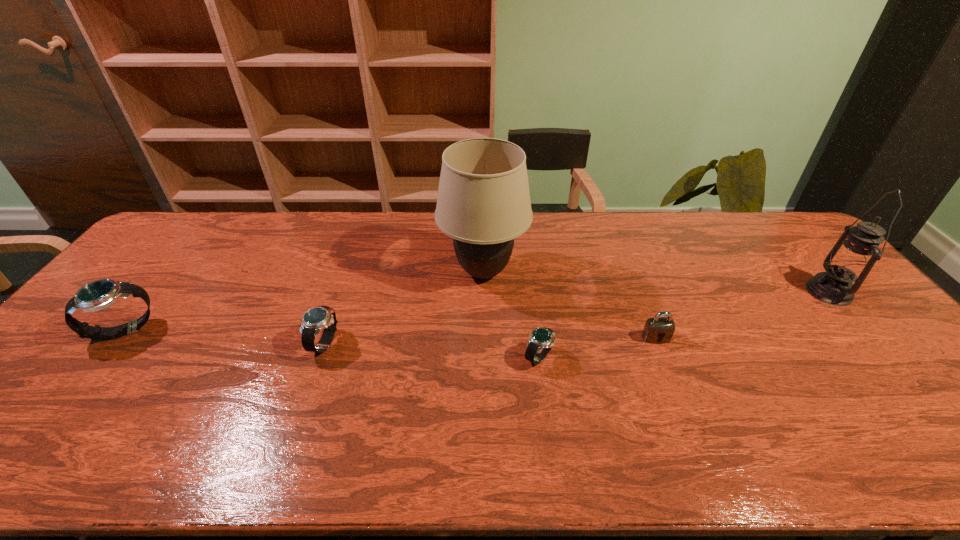
Find the location of a particular element. Image resolution: width=960 pixels, height=540 pixels. vacant space that is in between the shortest object and the lampshade is located at coordinates tap(511, 315).

Find the location of a particular element. vacant area that lies between the rightmost object and the lampshade is located at coordinates (656, 282).

Find the location of a particular element. The height and width of the screenshot is (540, 960). vacant point located between the oil lamp and the tallest watch is located at coordinates (477, 311).

Select which object appears as the closest to the leftmost object. Please provide its 2D coordinates. Your answer should be formatted as a tuple, i.e. [(x, y)], where the tuple contains the x and y coordinates of a point satisfying the conditions above.

[(315, 319)]

Find the location of a particular element. This screenshot has height=540, width=960. object that is the closest to the third tallest object is located at coordinates (315, 319).

Select which watch appears as the second closest to the rightmost watch. Please provide its 2D coordinates. Your answer should be formatted as a tuple, i.e. [(x, y)], where the tuple contains the x and y coordinates of a point satisfying the conditions above.

[(100, 294)]

Locate which watch is the closest to the rightmost object. Please provide its 2D coordinates. Your answer should be formatted as a tuple, i.e. [(x, y)], where the tuple contains the x and y coordinates of a point satisfying the conditions above.

[(541, 340)]

Identify the location of vacant region that satisfies the following two spatial constraints: 1. on the front side of the second watch from left to right; 2. on the left side of the shortest watch. This screenshot has width=960, height=540. (322, 357).

Image resolution: width=960 pixels, height=540 pixels. Find the location of `blank space that satisfies the following two spatial constraints: 1. on the front side of the rightmost watch; 2. on the left side of the leftmost object`. blank space that satisfies the following two spatial constraints: 1. on the front side of the rightmost watch; 2. on the left side of the leftmost object is located at coordinates (104, 357).